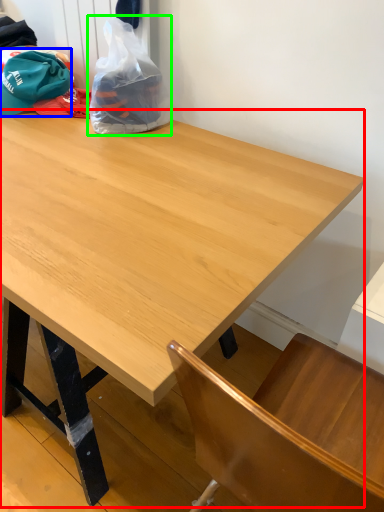
Question: Which object is positioned closest to table (highlighted by a red box)? Select from baseball hat (highlighted by a blue box) and plastic bag (highlighted by a green box).

Choices:
 (A) baseball hat
 (B) plastic bag

Answer: (B)